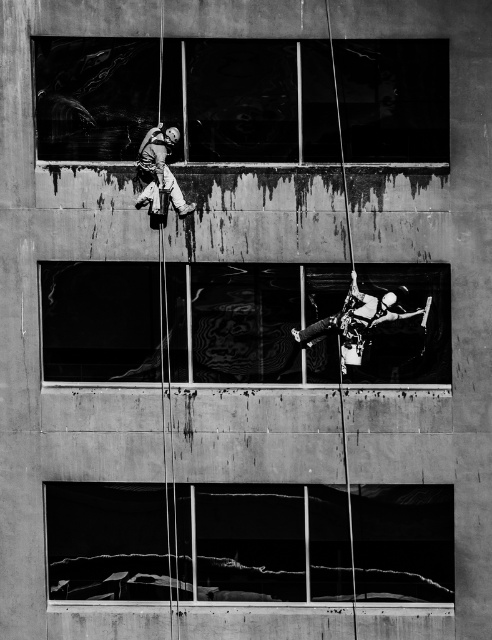
Question: Which point is farther from the camera taking this photo?

Choices:
 (A) (370, 308)
 (B) (122, 545)
 (C) (283, 68)
 (D) (189, 268)

Answer: (B)

Question: Is transparent glass window at upper center closer to the viewer compared to transparent glass window at lower center?

Choices:
 (A) yes
 (B) no

Answer: (A)

Question: Is transparent glass window at upper center smaller than transparent glass window at lower center?

Choices:
 (A) no
 (B) yes

Answer: (A)

Question: Is transparent glass window at lower center in front of matte gray climbing harness at upper center?

Choices:
 (A) yes
 (B) no

Answer: (B)

Question: Which point is closer to the camera?

Choices:
 (A) matte gray climbing harness at upper center
 (B) metallic climbing harness at center

Answer: (B)

Question: Estimate the real-world distances between objects in this image. Which object is closer to the transparent glass window at lower center?

Choices:
 (A) metallic climbing harness at center
 (B) matte gray climbing harness at upper center

Answer: (A)